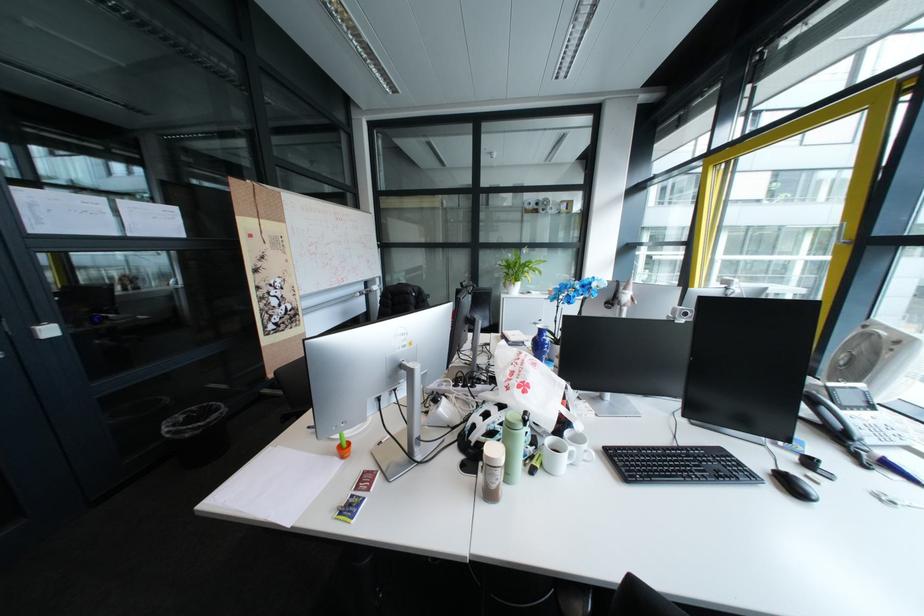
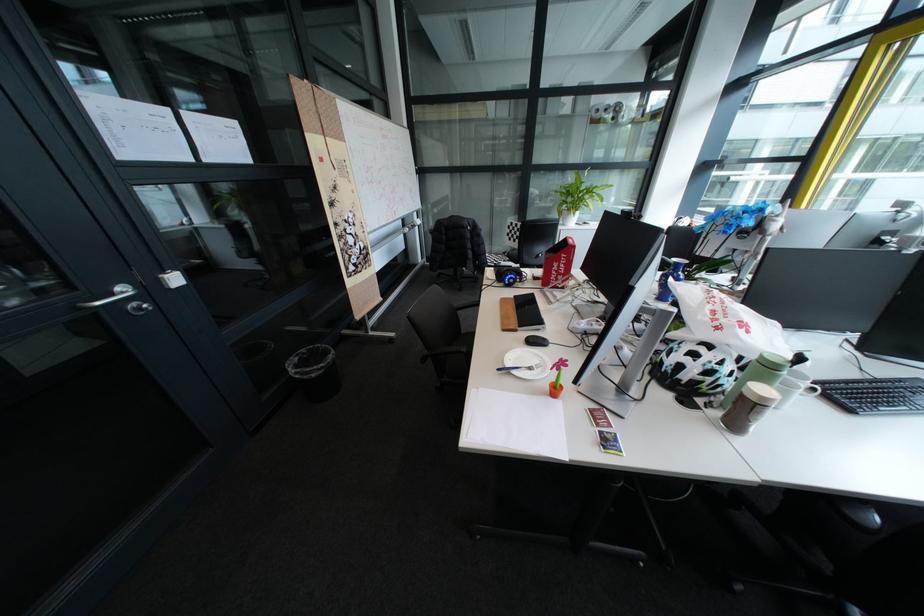
The point at (497,421) is marked in the first image. Where is the corresponding point in the second image?

(709, 361)